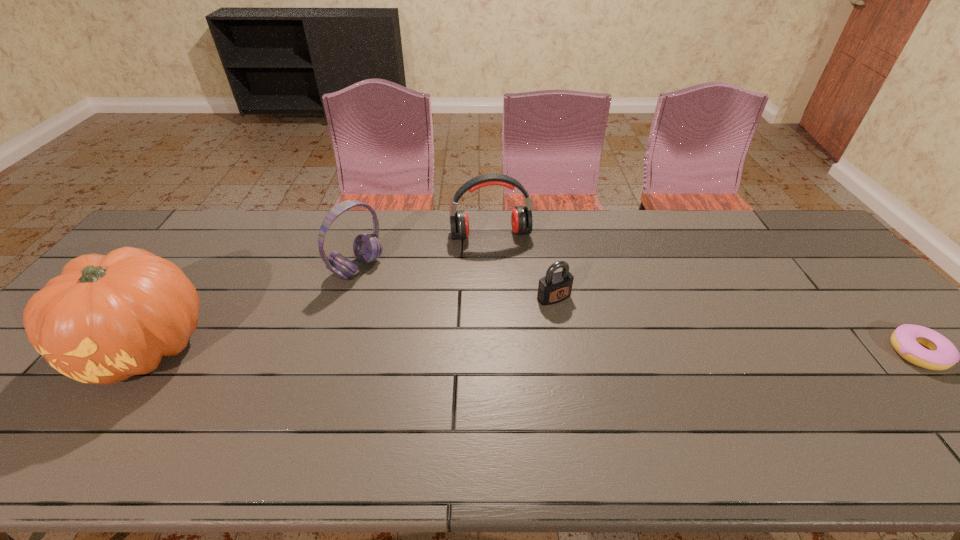
In order to click on pumpkin in this screenshot , I will do `click(105, 319)`.

In order to click on padlock in this screenshot , I will do `click(555, 287)`.

You are a GUI agent. You are given a task and a screenshot of the screen. Output one action in this format:
    pyautogui.click(x=<x>, y=<y>)
    Task: Click on the farthest object
    The image size is (960, 540).
    Given the screenshot: What is the action you would take?
    pyautogui.click(x=521, y=218)

The width and height of the screenshot is (960, 540). I want to click on the fourth object from right to left, so click(x=367, y=247).

Find the location of a particular element. Image resolution: width=960 pixels, height=540 pixels. the fourth nearest object is located at coordinates (367, 247).

The height and width of the screenshot is (540, 960). What are the coordinates of `vacant space situated 0.230m on the front of the padlock near the keyhole` in the screenshot? It's located at [614, 366].

Locate an element on the screen. This screenshot has height=540, width=960. free region located on the front of the padlock near the keyhole is located at coordinates (599, 349).

Identify the location of vacant space located 0.360m on the front of the padlock near the keyhole. The height and width of the screenshot is (540, 960). (651, 409).

Where is `vacant space located 0.260m on the ear cups of the earphone`? Image resolution: width=960 pixels, height=540 pixels. vacant space located 0.260m on the ear cups of the earphone is located at coordinates (511, 302).

Where is `free region located on the ear cups of the earphone`? The height and width of the screenshot is (540, 960). free region located on the ear cups of the earphone is located at coordinates coord(503,272).